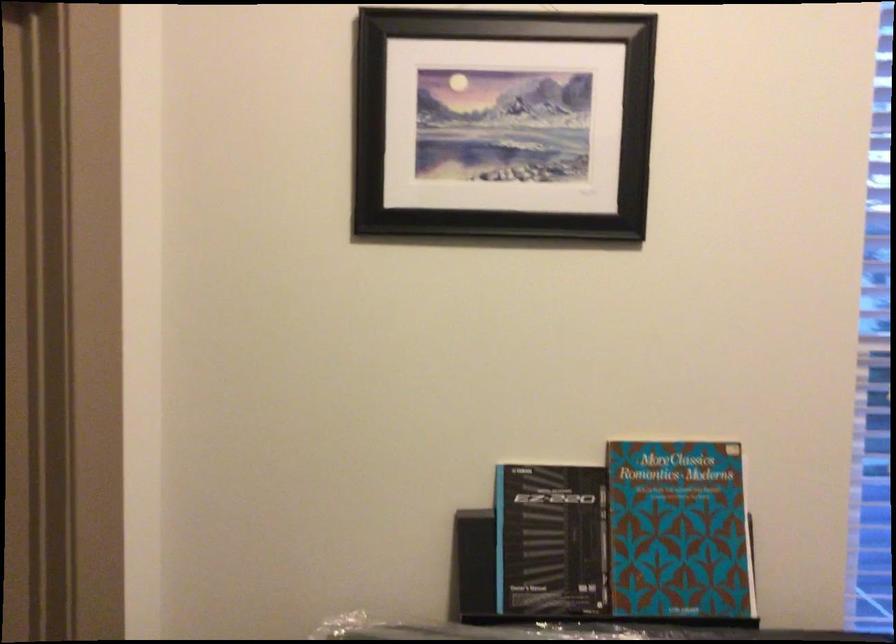
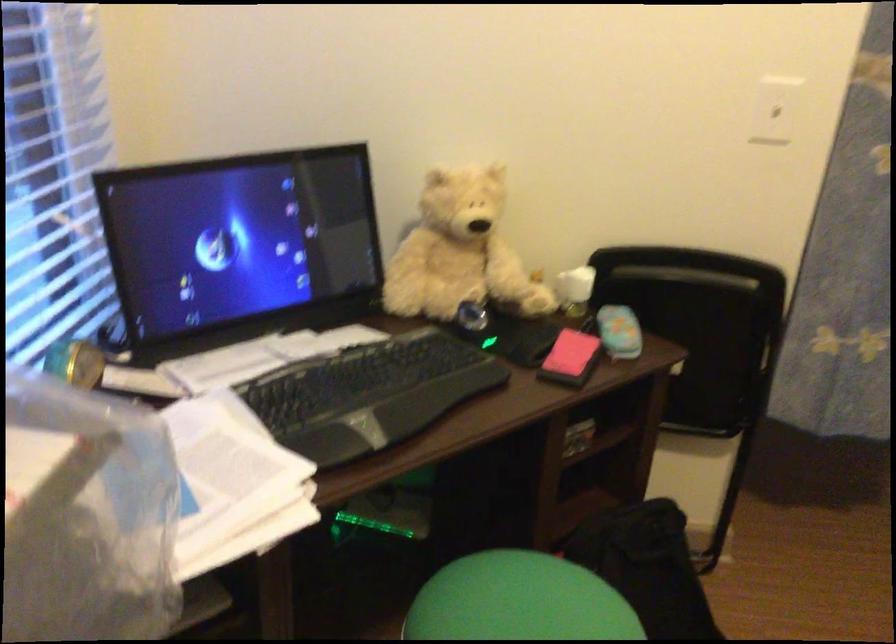
How did the camera likely rotate?

The camera rotated toward right-down.